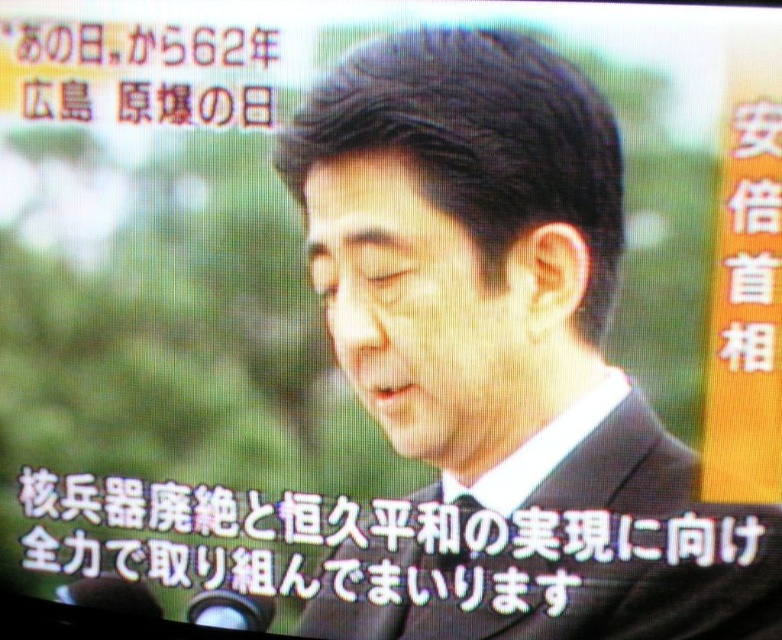
Based on the scene description, where exactly is the black suit at center located in terms of coordinates?

The black suit at center is located at point coordinates of (x=501, y=360).

Based on the scene description, can you determine which object, the black matte suit at center or the black matte text at lower center, is visually more prominent in the image?

The black matte suit at center is larger in size than the black matte text at lower center, making it more prominent.